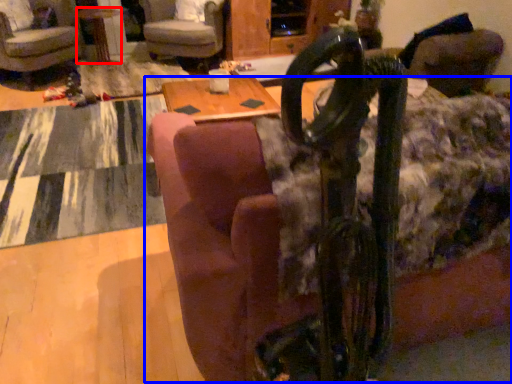
Question: Which of the following is the closest to the observer, table (highlighted by a red box) or couch (highlighted by a blue box)?

Choices:
 (A) table
 (B) couch

Answer: (B)